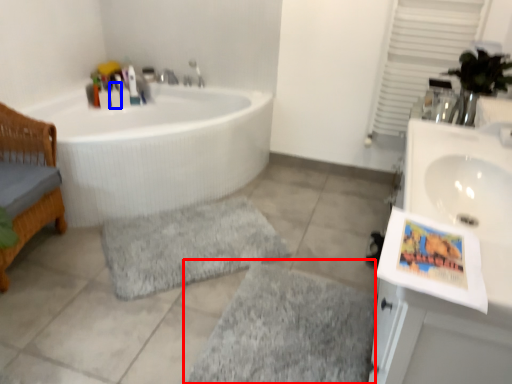
Question: Which object appears farthest to the camera in this image, bath mat (highlighted by a red box) or toiletry (highlighted by a blue box)?

Choices:
 (A) bath mat
 (B) toiletry

Answer: (B)